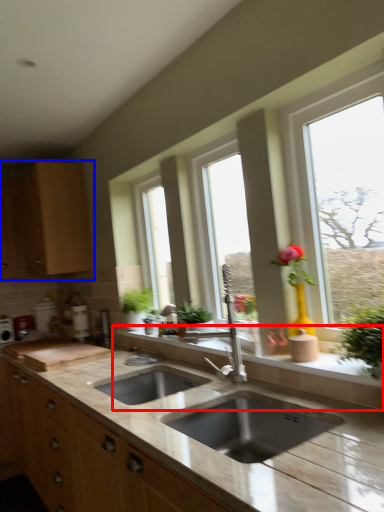
Question: Which object is closer to the camera taking this photo, window sill (highlighted by a red box) or cabinetry (highlighted by a blue box)?

Choices:
 (A) window sill
 (B) cabinetry

Answer: (A)